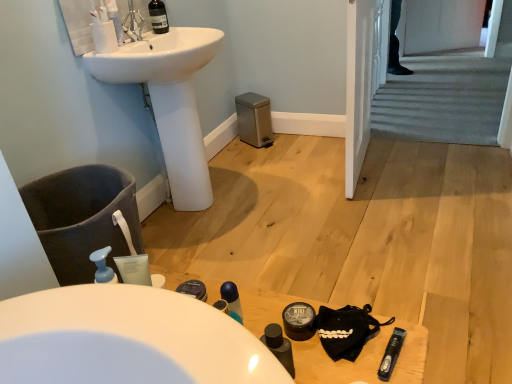
Where is `free spot to the right of white glossy sink at upper left`? This screenshot has width=512, height=384. free spot to the right of white glossy sink at upper left is located at coordinates (293, 197).